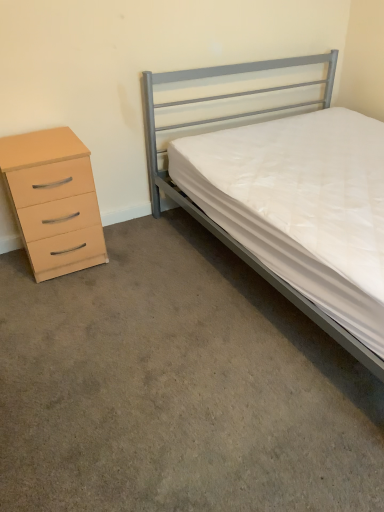
This screenshot has height=512, width=384. Identify the location of vacant region in front of beige matte chest of drawers at left. (56, 298).